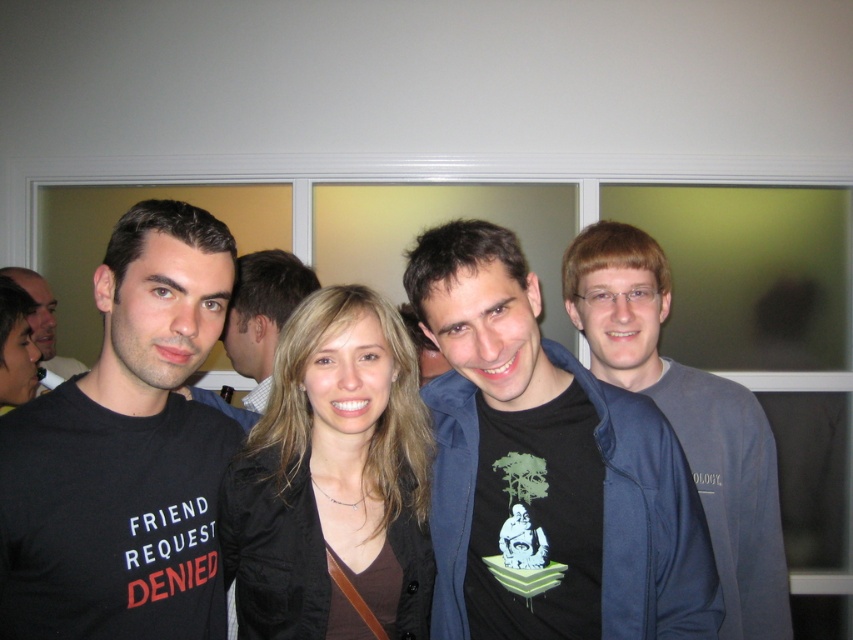
Question: Does blonde hair at center have a larger size compared to matte black t-shirt at left?

Choices:
 (A) no
 (B) yes

Answer: (A)

Question: Which of the following is the closest to the observer?

Choices:
 (A) (271, 260)
 (B) (596, 275)

Answer: (B)

Question: Which point is farther to the camera?

Choices:
 (A) matte black t-shirt at left
 (B) matte black shirt at center
 (C) black t-shirt with graphic at center
 (D) black matte t-shirt at left

Answer: (A)

Question: Considering the relative positions of matte black shirt at center and matte black t-shirt at left in the image provided, where is matte black shirt at center located with respect to matte black t-shirt at left?

Choices:
 (A) right
 (B) left

Answer: (A)

Question: Does blonde hair at center appear on the right side of gray fabric jacket at right?

Choices:
 (A) yes
 (B) no

Answer: (B)

Question: Which point is closer to the camera?

Choices:
 (A) matte black shirt at center
 (B) blonde hair at center
 (C) black matte t-shirt at left
 (D) black t-shirt with graphic at center

Answer: (C)